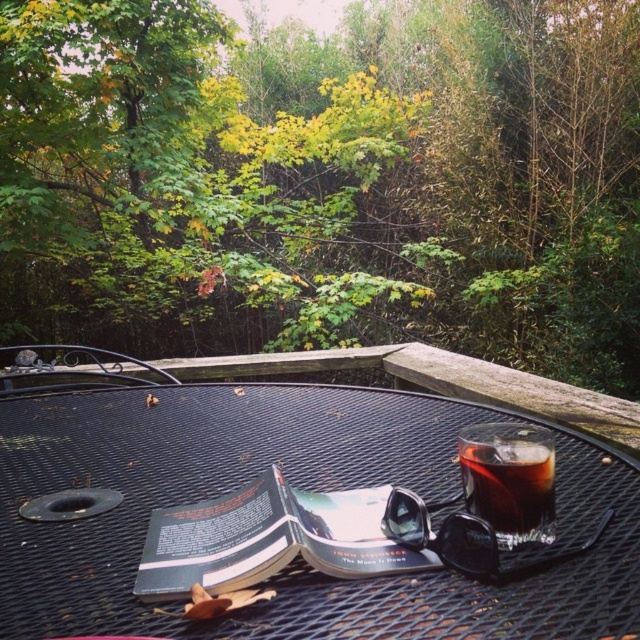
Question: Based on their relative distances, which object is farther from the black mesh table at center?

Choices:
 (A) green leafy tree at upper center
 (B) dark glass cup at center

Answer: (A)

Question: Which point is farther from the camera taking this photo?

Choices:
 (A) (499, 436)
 (B) (61, 561)
 (C) (316, 138)

Answer: (C)

Question: Does green leafy tree at upper center appear on the left side of dark glass cup at center?

Choices:
 (A) no
 (B) yes

Answer: (A)

Question: Can you confirm if green leafy tree at upper center is thinner than dark glass cup at center?

Choices:
 (A) no
 (B) yes

Answer: (A)

Question: Can you confirm if green leafy tree at upper center is positioned to the left of black mesh table at center?

Choices:
 (A) yes
 (B) no

Answer: (B)

Question: Which point is closer to the camera taking this photo?

Choices:
 (A) click(x=515, y=522)
 (B) click(x=310, y=630)

Answer: (B)